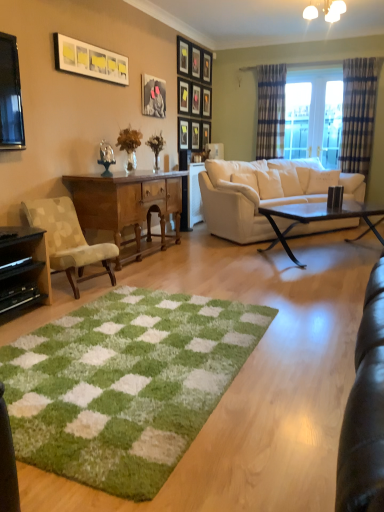
Find the location of a particular element. This screenshot has width=384, height=512. vacant area on top of green shaggy rug at center (from a real-world perspective) is located at coordinates (118, 352).